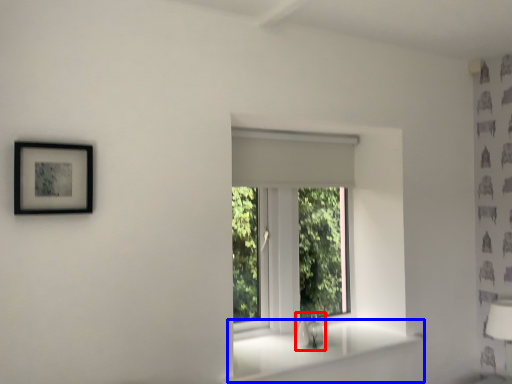
Question: Which object appears farthest to the camera in this image, sink (highlighted by a red box) or window sill (highlighted by a blue box)?

Choices:
 (A) sink
 (B) window sill

Answer: (A)